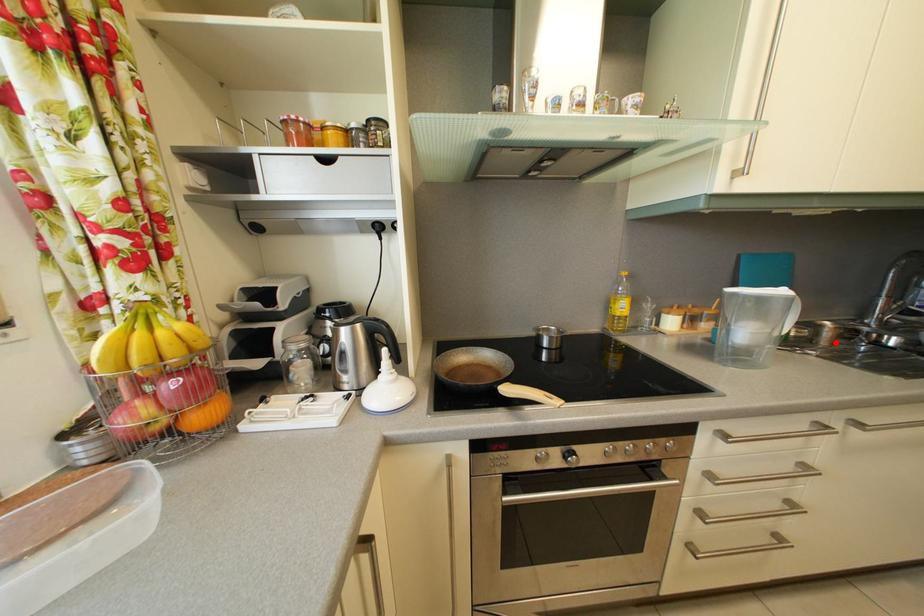
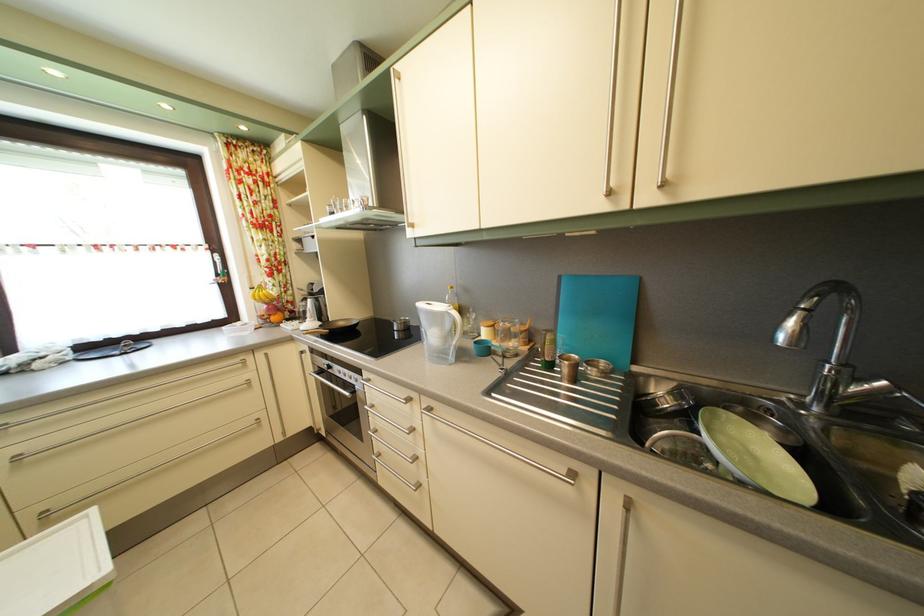
Locate, in the second image, the point that corresponds to the highlighted location in the first image.

(574, 378)